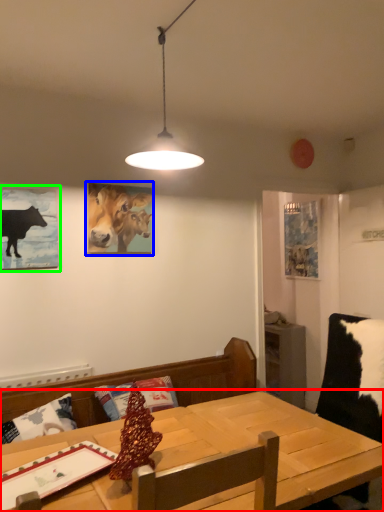
Question: Based on their relative distances, which object is nearer to table (highlighted by a red box)? Choose from picture frame (highlighted by a blue box) and picture frame (highlighted by a green box).

Choices:
 (A) picture frame
 (B) picture frame

Answer: (B)